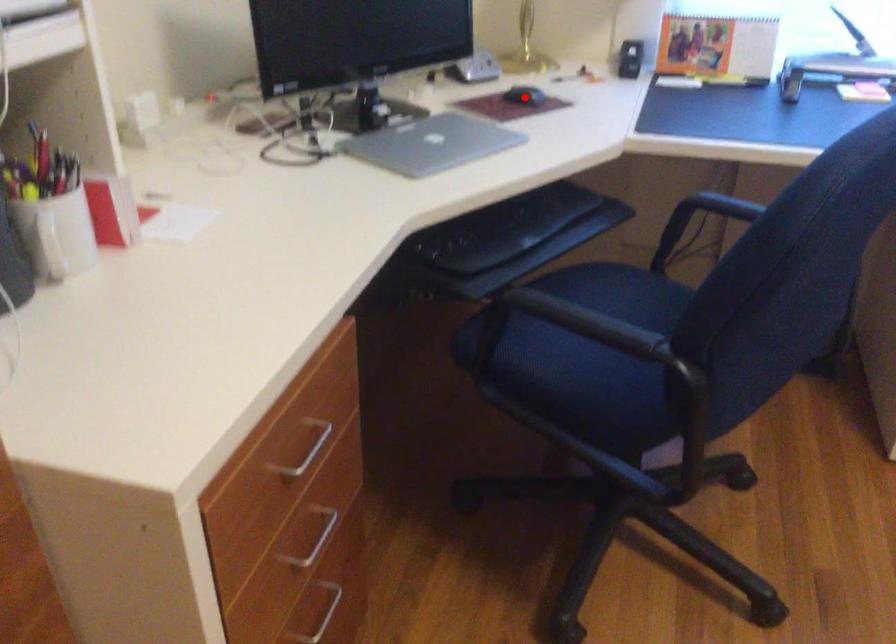
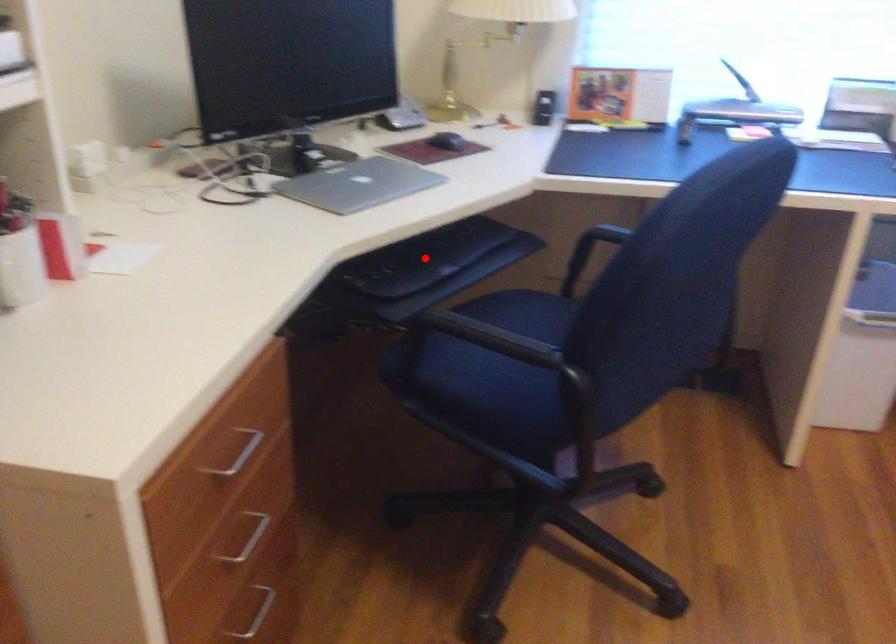
I am providing you with two images of the same scene from different viewpoints. A red point is marked on the first image and another point is marked on the second image. Is the marked point in image1 the same physical position as the marked point in image2?

No